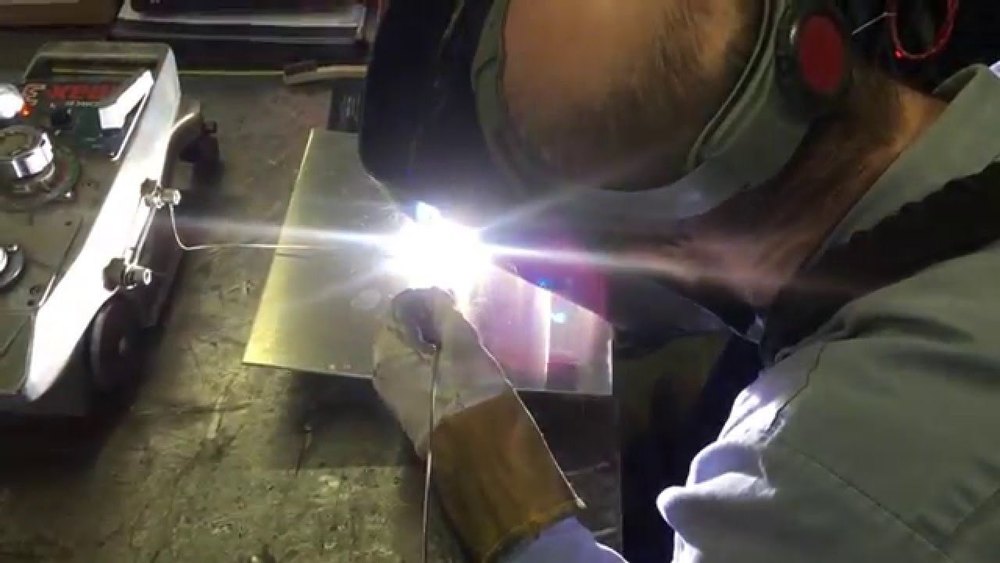
Image resolution: width=1000 pixels, height=563 pixels. What are the coordinates of `surface` in the screenshot? It's located at (244, 493).